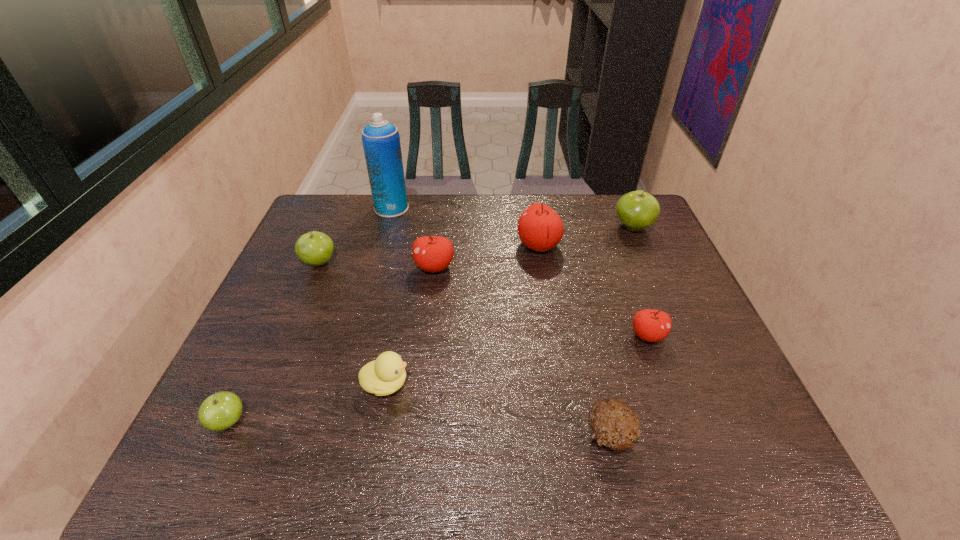
Identify the location of vacant point at the near edge. pyautogui.click(x=420, y=448).

This screenshot has width=960, height=540. What are the coordinates of `vacant space at the left edge` in the screenshot? It's located at (255, 337).

In the image, there is a desktop. What are the coordinates of `vacant space at the right edge` in the screenshot? It's located at (652, 251).

I want to click on blank region between the fourth apple from right to left and the smallest red apple, so click(x=540, y=301).

I want to click on empty space between the smallest green apple and the biggest green apple, so click(430, 325).

Locate an element on the screen. The image size is (960, 540). vacant area that lies between the biggest green apple and the rightmost red apple is located at coordinates (640, 281).

Where is `free space between the smallest green apple and the muffin`? The image size is (960, 540). free space between the smallest green apple and the muffin is located at coordinates (419, 428).

The image size is (960, 540). Identify the location of empty space that is in between the fourth nearest object and the biggest green apple. (640, 281).

Locate an element on the screen. This screenshot has height=540, width=960. free spot between the nearest apple and the duckling is located at coordinates (307, 403).

The image size is (960, 540). Identify the location of vacant region between the muffin and the smallest green apple. pyautogui.click(x=419, y=428).